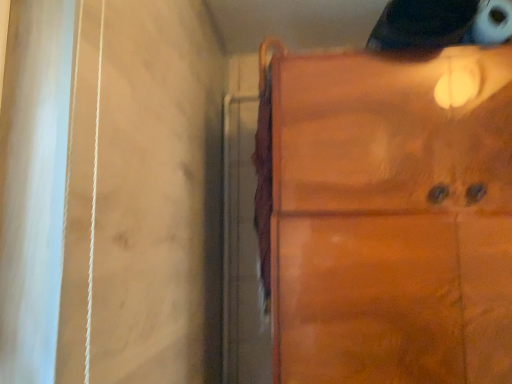
Where is `wooden cabinet at right`? The height and width of the screenshot is (384, 512). wooden cabinet at right is located at coordinates (391, 220).

Image resolution: width=512 pixels, height=384 pixels. What do you see at coordinates (391, 220) in the screenshot?
I see `wooden cabinet at right` at bounding box center [391, 220].

I want to click on wooden cabinet at right, so click(391, 220).